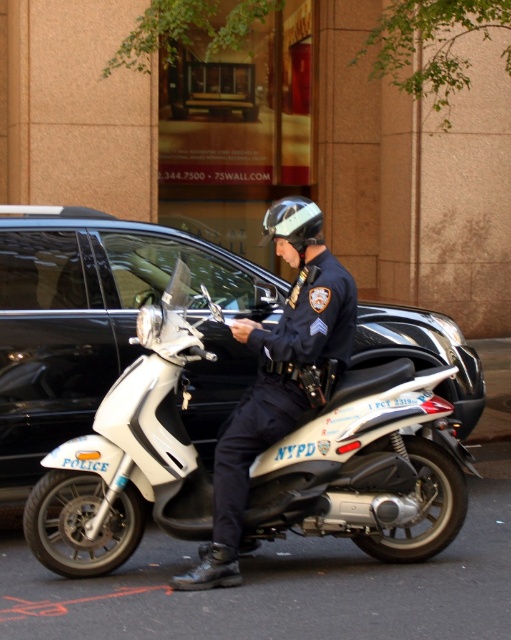
Does white matte scooter at center have a smaller size compared to navy blue uniform at center?

No.

Can you confirm if white matte scooter at center is positioned above navy blue uniform at center?

Yes.

Does point (370, 308) come in front of point (266, 416)?

No, (370, 308) is behind (266, 416).

You are a GUI agent. You are given a task and a screenshot of the screen. Output one action in this format:
    pyautogui.click(x=<x>, y=<y>)
    Task: Click on the white matte scooter at center
    This screenshot has width=511, height=640.
    Given the screenshot: What is the action you would take?
    pyautogui.click(x=89, y=316)